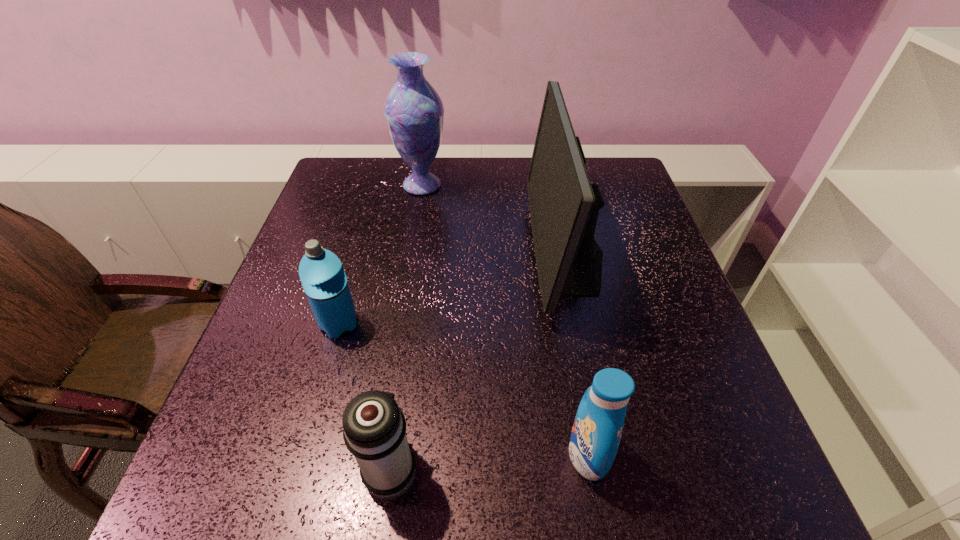
Locate an element on the screen. The image size is (960, 540). empty location between the detergent and the nearer thermos bottle is located at coordinates (490, 462).

Where is `vacant point located between the detergent and the right thermos bottle`? Image resolution: width=960 pixels, height=540 pixels. vacant point located between the detergent and the right thermos bottle is located at coordinates (490, 462).

You are a GUI agent. You are given a task and a screenshot of the screen. Output one action in this format:
    pyautogui.click(x=<x>, y=<y>)
    Task: Click on the free spot between the computer monitor and the leftmost object
    The image size is (960, 540).
    Given the screenshot: What is the action you would take?
    pyautogui.click(x=453, y=289)

Identify the location of free point between the vase and the detergent. The width and height of the screenshot is (960, 540). (505, 320).

Locate an element on the screen. Image resolution: width=960 pixels, height=540 pixels. vacant space in between the detergent and the vase is located at coordinates (505, 320).

At what (x,y) coordinates should I click in order to perform the action: click on vacant space that's between the vase and the computer monitor. Please return your answer as a coordinate pair (x, y). Looking at the image, I should click on (494, 219).

Identify the location of blank region between the vase and the farther thermos bottle. (381, 255).

At what (x,y) coordinates should I click in order to perform the action: click on empty space that is in between the vase and the nearer thermos bottle. Please return your answer as a coordinate pair (x, y). The height and width of the screenshot is (540, 960). Looking at the image, I should click on (407, 327).

Image resolution: width=960 pixels, height=540 pixels. I want to click on free space between the farther thermos bottle and the vase, so click(381, 255).

Locate an element on the screen. This screenshot has width=960, height=540. free space between the vase and the computer monitor is located at coordinates (494, 219).